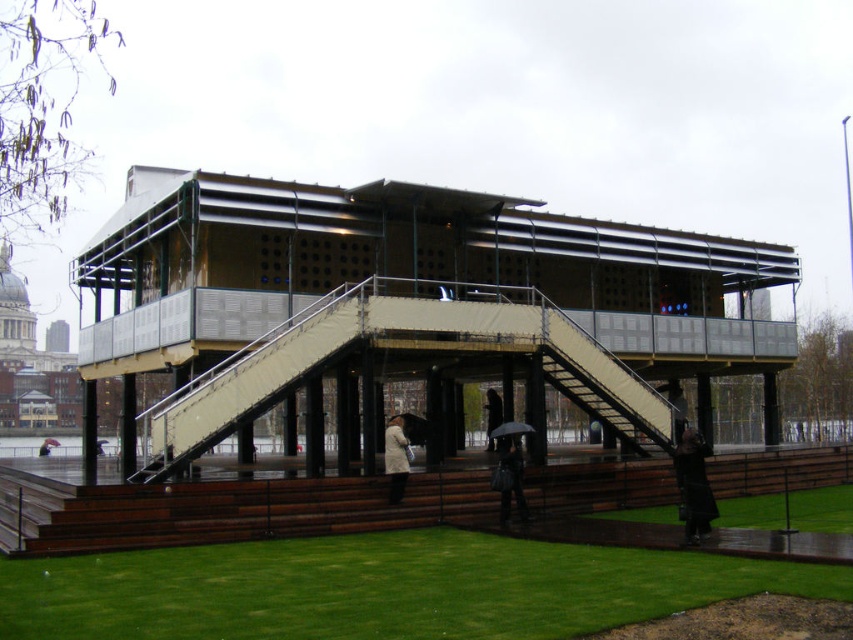
Who is lower down, dark brown leather umbrella at lower center or red matte umbrella at center?

red matte umbrella at center is below.

Is point (39, 454) in front of point (49, 445)?

Yes, point (39, 454) is closer to viewer.

Between point (45, 454) and point (48, 442), which one is positioned behind?

The point (48, 442) is behind.

The image size is (853, 640). Identify the location of dark brown leather umbrella at lower center. (45, 448).

Looking at this image, does transparent plastic umbrella at center have a greater width compared to dark brown leather coat at center?

Yes.

Is point (399, 417) more distant than point (498, 416)?

That is False.

Is point (392, 419) positioned behind point (492, 422)?

No.

The width and height of the screenshot is (853, 640). Find the location of `transparent plastic umbrella at center`. transparent plastic umbrella at center is located at coordinates (412, 428).

Who is higher up, black matte umbrella at center or red matte umbrella at center?

black matte umbrella at center is higher up.

Does black matte umbrella at center have a greater height compared to red matte umbrella at center?

No.

You are a GUI agent. You are given a task and a screenshot of the screen. Output one action in this format:
    pyautogui.click(x=<x>, y=<y>)
    Task: Click on the black matte umbrella at center
    The height and width of the screenshot is (640, 853).
    Given the screenshot: What is the action you would take?
    [509, 429]